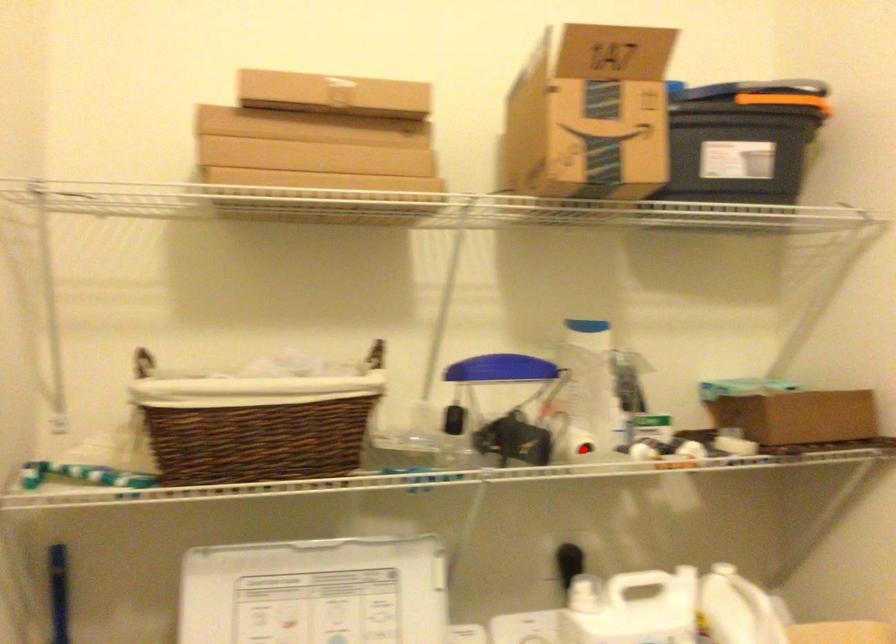
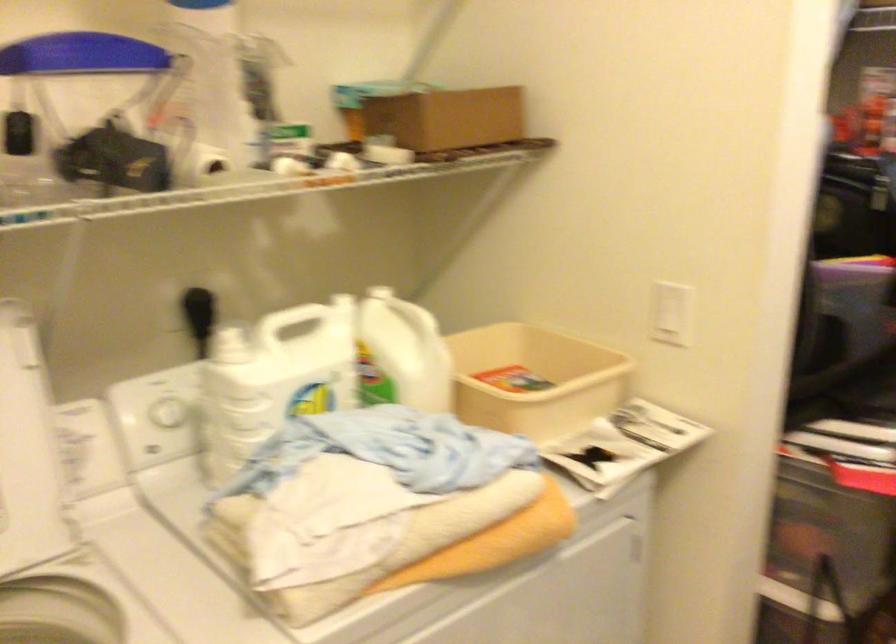
Find the pixel in the second image that matches the highlighted location in the first image.

(211, 162)